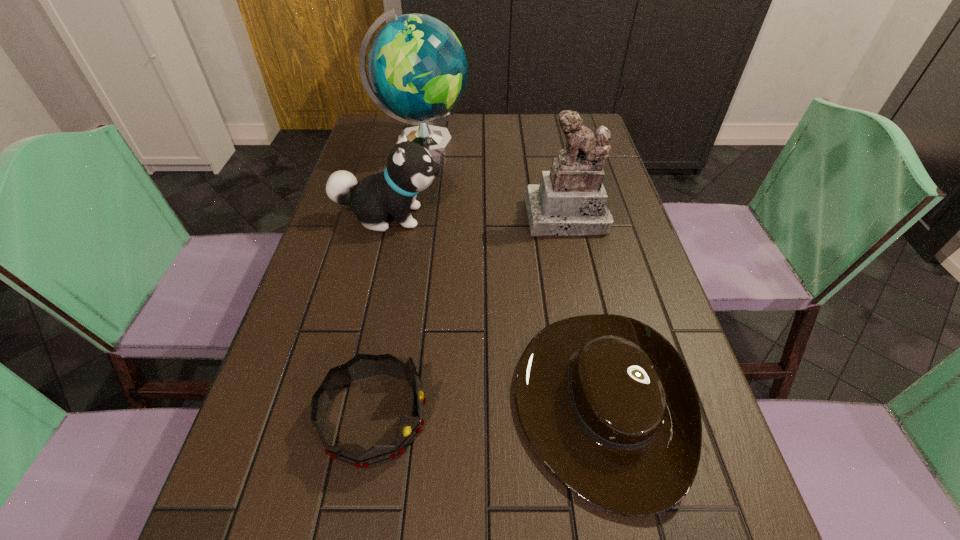
The height and width of the screenshot is (540, 960). Identify the location of vacant space at the far right corner of the desktop. (586, 120).

Identify the location of vacant area that lies between the globe and the figurine. The width and height of the screenshot is (960, 540). (494, 180).

This screenshot has height=540, width=960. Identify the location of vacant region between the second shortest object and the puppy. (381, 317).

Locate an element on the screen. free space between the second shortest object and the puppy is located at coordinates (381, 317).

Where is `free point between the farthest object and the second tallest object`? The height and width of the screenshot is (540, 960). free point between the farthest object and the second tallest object is located at coordinates (494, 180).

Where is `free space between the figurine and the puppy`? This screenshot has width=960, height=540. free space between the figurine and the puppy is located at coordinates (479, 217).

Find the location of a particular element. The height and width of the screenshot is (540, 960). empty location between the farthest object and the fourth tallest object is located at coordinates (397, 280).

This screenshot has height=540, width=960. I want to click on vacant area between the puppy and the second tallest object, so click(x=479, y=217).

Image resolution: width=960 pixels, height=540 pixels. Identify the location of free space between the shortest object and the tallest object. (508, 273).

Where is `the second closest object to the third shortest object`? Image resolution: width=960 pixels, height=540 pixels. the second closest object to the third shortest object is located at coordinates click(571, 200).